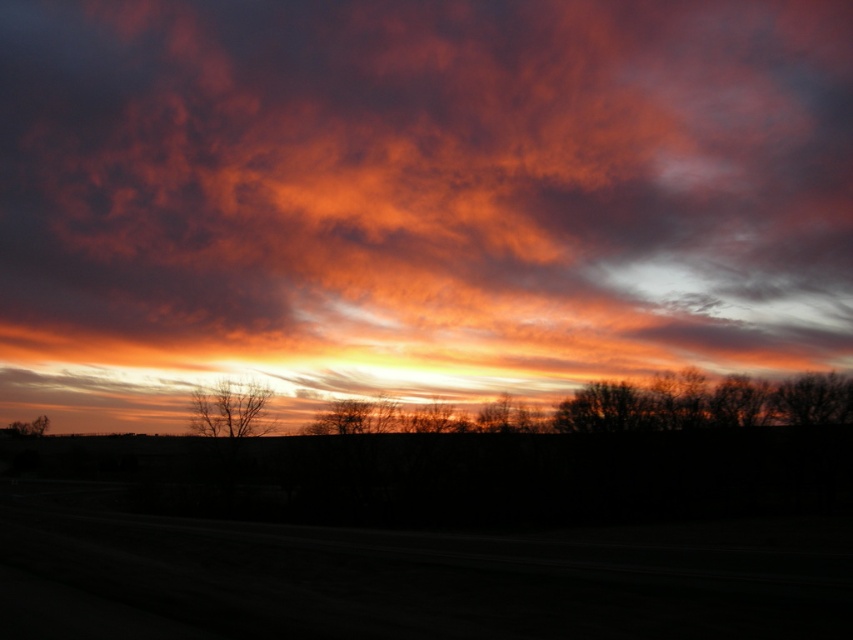
You are standing in the middle of the scene and want to take a photo of both point (656, 200) and point (804, 424). Which point is closer to your camera lens?

Point (804, 424) is closer to the camera lens because it is less further away than point (656, 200), which is further to the camera.

You are standing in front of the sunset scene. There are two points marked in the image. The first point is at coordinate point (x=606, y=400) and the second is at point (x=525, y=428). If you want to touch the point that is closer to you, which coordinate should you choose?

Point (x=606, y=400) is closer to the camera, so you should choose that coordinate.

You are an artist trying to paint the sunset scene. You want to ensure the trees are proportionally accurate. Which tree should you paint narrower, the silhouette bare tree at right or the brown matte tree at lower left?

The silhouette bare tree at right should be painted narrower because its width is less than the brown matte tree at lower left.